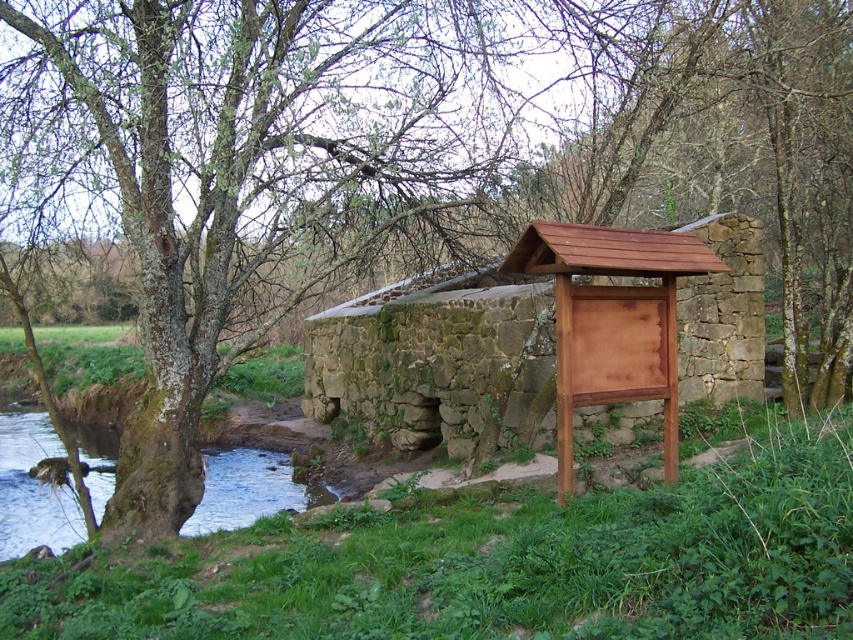
Looking at this image, you are a hiker who wants to cross the clear water at lower left to reach the brown wooden sign at center. Is the sign above the water, making it accessible by walking on a path over the water?

The brown wooden sign at center is above clear water at lower left, so yes, the sign is positioned over the water, likely on a path or structure, making it accessible by walking over the water.